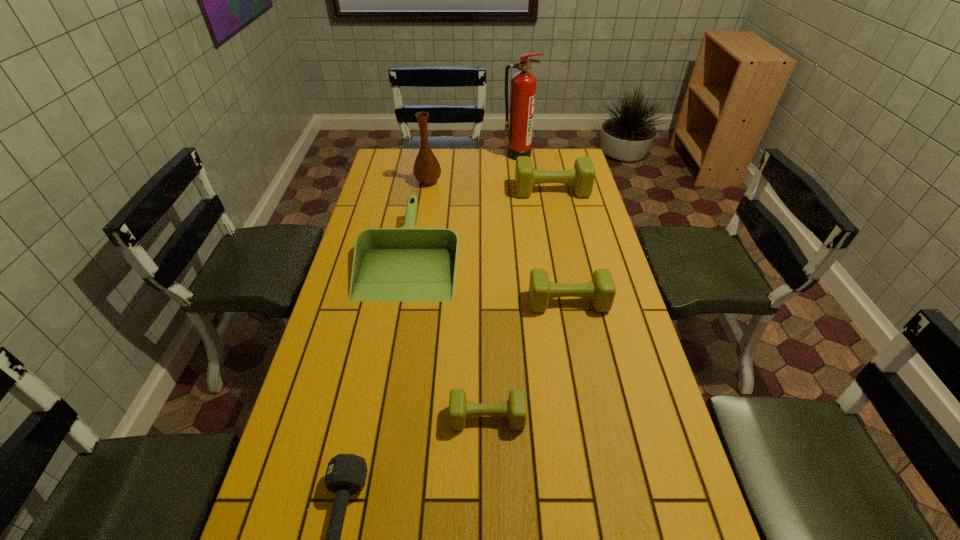
At what (x,y) coordinates should I click in order to perform the action: click on vacant space at the far edge of the desktop. Please return your answer as a coordinate pair (x, y). Looking at the image, I should click on (538, 160).

This screenshot has width=960, height=540. Find the location of `vacant area at the left edge`. vacant area at the left edge is located at coordinates (337, 331).

Identify the location of vacant region at the right edge of the desktop. This screenshot has width=960, height=540. (601, 248).

In the image, there is a desktop. Where is `free region at the far left corner`? This screenshot has height=540, width=960. free region at the far left corner is located at coordinates (379, 172).

You are a GUI agent. You are given a task and a screenshot of the screen. Output one action in this format:
    pyautogui.click(x=<x>, y=<y>)
    Task: Click on the free point at the far right corner
    This screenshot has height=540, width=960.
    Given the screenshot: What is the action you would take?
    pyautogui.click(x=571, y=166)

Where is `vacant point located between the second nearest olive dumbbell and the tallest dumbbell`? This screenshot has height=540, width=960. vacant point located between the second nearest olive dumbbell and the tallest dumbbell is located at coordinates (560, 246).

At what (x,y) coordinates should I click in order to perform the action: click on unoccupied area between the second farthest olive dumbbell and the third tallest object. Please return your answer as a coordinate pair (x, y). The width and height of the screenshot is (960, 540). Looking at the image, I should click on (560, 246).

Select which object appears as the second closest to the dustpan. Please provide its 2D coordinates. Your answer should be formatted as a tuple, i.e. [(x, y)], where the tuple contains the x and y coordinates of a point satisfying the conditions above.

[(601, 290)]

This screenshot has width=960, height=540. Find the location of `the fifth closest object relative to the fire extinguisher`. the fifth closest object relative to the fire extinguisher is located at coordinates (514, 409).

Identify which dumbbell is the third closest to the dustpan. Please provide its 2D coordinates. Your answer should be formatted as a tuple, i.e. [(x, y)], where the tuple contains the x and y coordinates of a point satisfying the conditions above.

[(514, 409)]